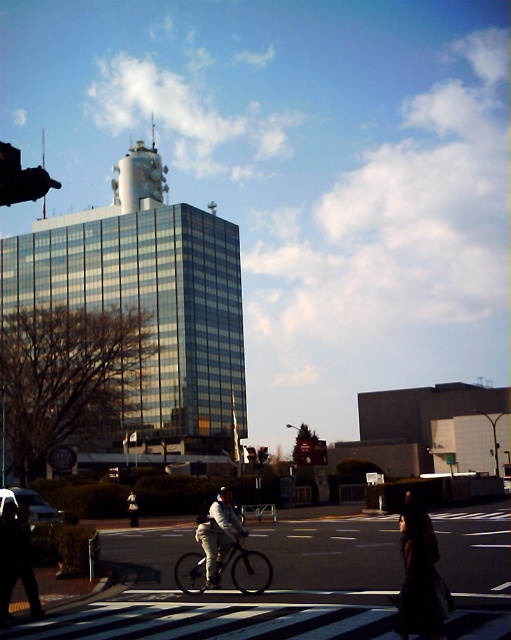
Question: Which point is farther from the camera taking this photo?

Choices:
 (A) (269, 579)
 (B) (4, 598)

Answer: (A)

Question: Is black matte bicycle at center behind dark gray fabric jacket at lower center?

Choices:
 (A) yes
 (B) no

Answer: (B)

Question: Which point is farther to the camera?

Choices:
 (A) (132, 500)
 (B) (422, 632)
 (C) (13, 179)
 (D) (10, 579)

Answer: (A)

Question: Can you confirm if black matte bicycle at center is positioned to the right of metallic pole at upper center?

Choices:
 (A) no
 (B) yes

Answer: (B)

Question: Considering the real-world distances, which object is closest to the dark brown fabric dress at lower right?

Choices:
 (A) dark gray pants at lower left
 (B) metallic pole at upper center

Answer: (A)

Question: Is dark gray pants at lower left closer to camera compared to metallic pole at upper center?

Choices:
 (A) yes
 (B) no

Answer: (B)